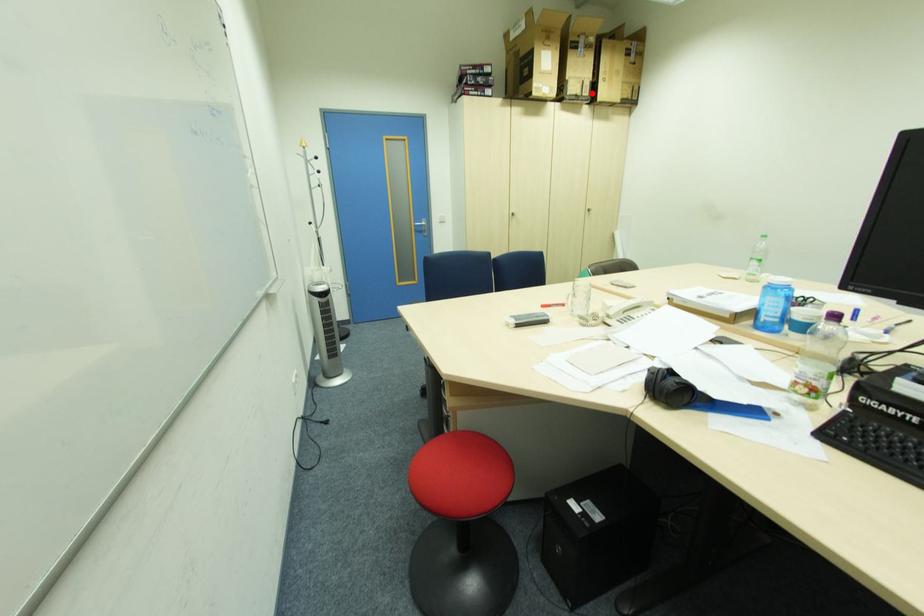
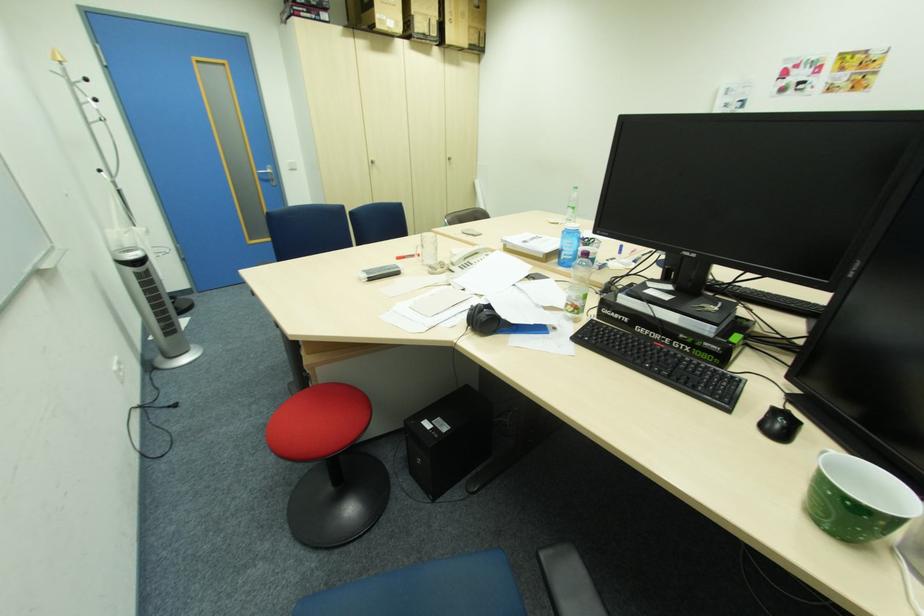
Where in the second image is the point corresponding to the highlighted location from the first image?

(441, 31)